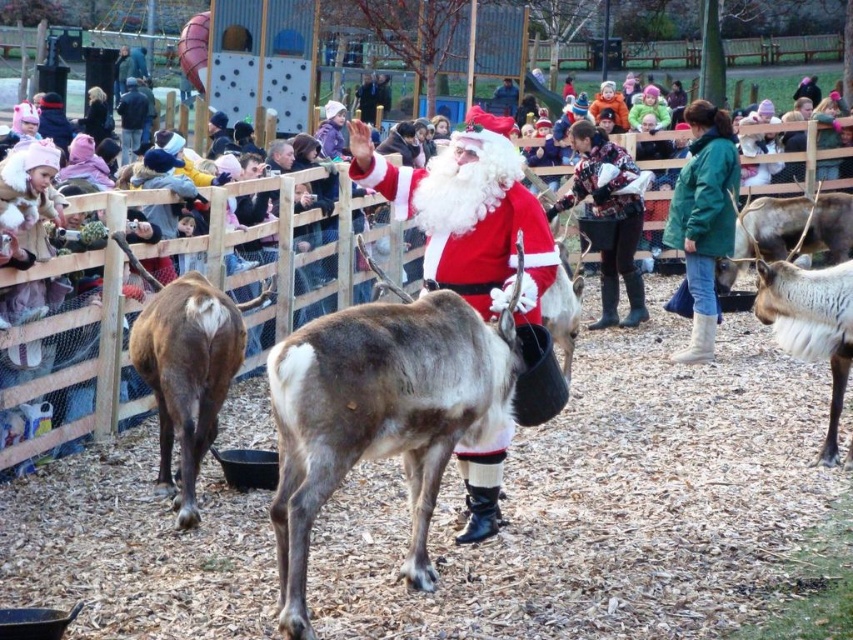
Question: Based on their relative distances, which object is nearer to the brown fuzzy reindeer at left?

Choices:
 (A) brown speckled fur at center
 (B) dark brown leather boots at center
 (C) green suede boots at lower right

Answer: (A)

Question: Which of the following is the farthest from the observer?

Choices:
 (A) brown speckled fur at center
 (B) green suede boots at lower right

Answer: (B)

Question: Does brown fuzzy reindeer at left appear on the left side of dark brown leather boots at center?

Choices:
 (A) no
 (B) yes

Answer: (B)

Question: In this image, where is brown speckled fur at center located relative to matte red santa at center?

Choices:
 (A) left
 (B) right

Answer: (A)

Question: Where is green suede boots at lower right located in relation to white fur reindeer at right in the image?

Choices:
 (A) below
 (B) above

Answer: (B)

Question: Which object is the farthest from the brown speckled fur at center?

Choices:
 (A) brown fuzzy reindeer at left
 (B) green suede boots at lower right

Answer: (B)